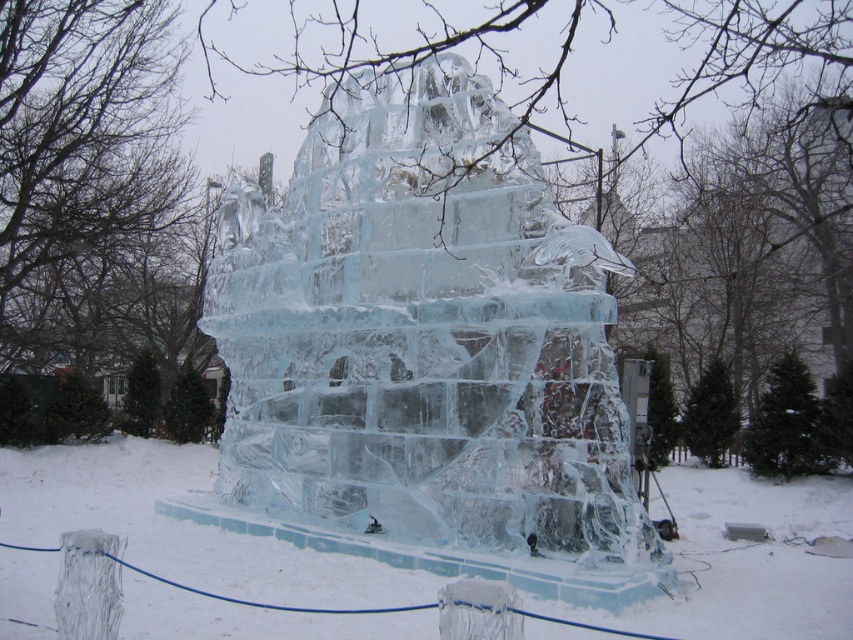
Question: Which of the following is the closest to the observer?

Choices:
 (A) (582, 371)
 (B) (819, 513)

Answer: (A)

Question: Can you confirm if clear ice sculpture at center is smaller than transparent ice sculpture at center?

Choices:
 (A) no
 (B) yes

Answer: (B)

Question: Is clear ice sculpture at center closer to the viewer compared to transparent ice sculpture at center?

Choices:
 (A) no
 (B) yes

Answer: (A)

Question: Can you confirm if clear ice sculpture at center is positioned below transparent ice sculpture at center?

Choices:
 (A) no
 (B) yes

Answer: (A)

Question: Which point is closer to the camera?

Choices:
 (A) transparent ice sculpture at center
 (B) clear ice sculpture at center

Answer: (A)